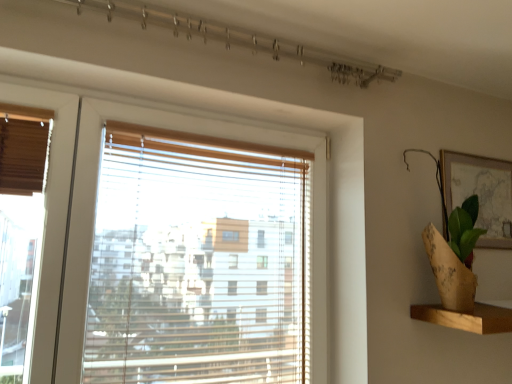
Question: Based on their sizes in the image, would you say burlap wrapped plant at right is bigger or smaller than matte gold picture frame at upper right?

Choices:
 (A) big
 (B) small

Answer: (A)

Question: Is burlap wrapped plant at right in front of or behind matte gold picture frame at upper right in the image?

Choices:
 (A) behind
 (B) front

Answer: (B)

Question: Which object is the closest to the burlap wrapped plant at right?

Choices:
 (A) transparent plastic blinds at center
 (B) wooden at right
 (C) matte gold picture frame at upper right

Answer: (C)

Question: Considering the real-world distances, which object is farthest from the matte gold picture frame at upper right?

Choices:
 (A) wooden at right
 (B) burlap wrapped plant at right
 (C) transparent plastic blinds at center

Answer: (C)